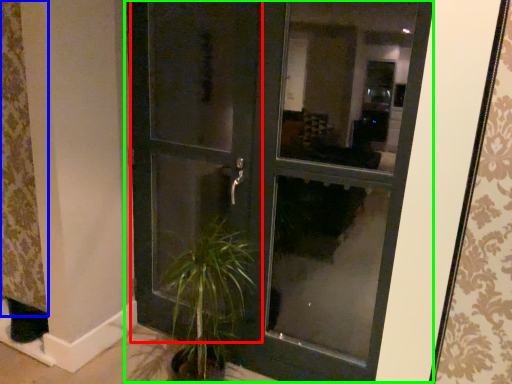
Question: Considering the real-world distances, which object is farthest from screen door (highlighted by a red box)? curtain (highlighted by a blue box) or door (highlighted by a green box)?

Choices:
 (A) curtain
 (B) door

Answer: (A)